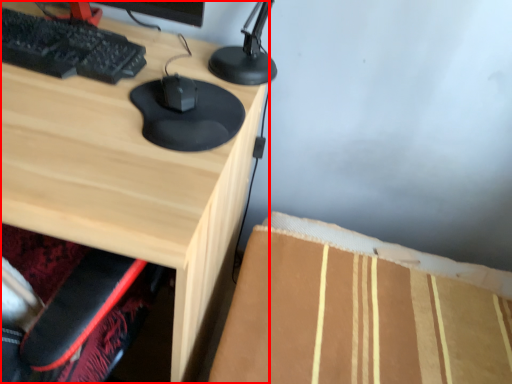
Question: From the image's perspective, where is desk (annotated by the red box) located relative to mouse?

Choices:
 (A) below
 (B) above

Answer: (A)